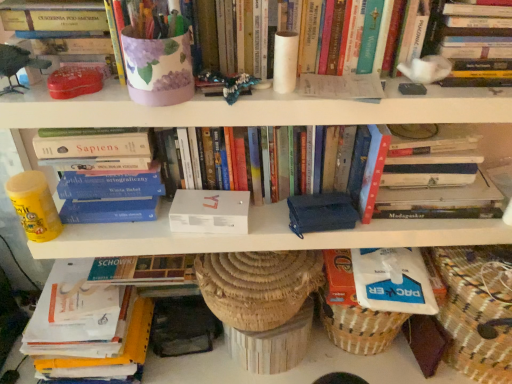
Question: Is matte purple vase at upper center, which ranks as the fifth book in bottom-to-top order, positioned with its back to hardcover book at left, the 5th book from the top?

Choices:
 (A) no
 (B) yes

Answer: (A)

Question: Considering the relative sizes of matte purple vase at upper center, which ranks as the fifth book in bottom-to-top order, and hardcover book at left, acting as the 2th book starting from the bottom, in the image provided, is matte purple vase at upper center, which ranks as the fifth book in bottom-to-top order, taller than hardcover book at left, acting as the 2th book starting from the bottom,?

Choices:
 (A) yes
 (B) no

Answer: (B)

Question: Does matte purple vase at upper center, which ranks as the fifth book in bottom-to-top order, appear on the left side of hardcover book at left, the 5th book from the top?

Choices:
 (A) yes
 (B) no

Answer: (B)

Question: Are matte purple vase at upper center, which appears as the 2th book when viewed from the top, and hardcover book at left, the 5th book from the top, located far from each other?

Choices:
 (A) no
 (B) yes

Answer: (A)

Question: Would you say matte purple vase at upper center, which ranks as the fifth book in bottom-to-top order, is outside hardcover book at left, the 5th book from the top?

Choices:
 (A) yes
 (B) no

Answer: (A)

Question: Is the depth of matte purple vase at upper center, which appears as the 2th book when viewed from the top, less than that of hardcover book at left, acting as the 2th book starting from the bottom?

Choices:
 (A) no
 (B) yes

Answer: (B)

Question: Can you confirm if white matte box at center, the fourth book from the top, is wider than hardcover book at upper right, which appears as the sixth book when ordered from the bottom?

Choices:
 (A) no
 (B) yes

Answer: (A)

Question: From the image's perspective, is white matte box at center, which ranks as the third book in bottom-to-top order, located beneath hardcover book at upper right, arranged as the 1th book when viewed from the top?

Choices:
 (A) yes
 (B) no

Answer: (A)

Question: Is white matte box at center, which ranks as the third book in bottom-to-top order, in front of hardcover book at upper right, arranged as the 1th book when viewed from the top?

Choices:
 (A) no
 (B) yes

Answer: (A)

Question: Is white matte box at center, the fourth book from the top, positioned behind hardcover book at upper right, which appears as the sixth book when ordered from the bottom?

Choices:
 (A) no
 (B) yes

Answer: (B)

Question: Is hardcover book at upper right, which appears as the sixth book when ordered from the bottom, at the back of white matte box at center, the fourth book from the top?

Choices:
 (A) no
 (B) yes

Answer: (A)

Question: Is white matte box at center, which ranks as the third book in bottom-to-top order, next to hardcover book at upper right, which appears as the sixth book when ordered from the bottom?

Choices:
 (A) yes
 (B) no

Answer: (B)

Question: Could you tell me if white matte box at center, the first paperback book from the left, is facing hardcover book at upper right, arranged as the 1th book when viewed from the top?

Choices:
 (A) yes
 (B) no

Answer: (B)